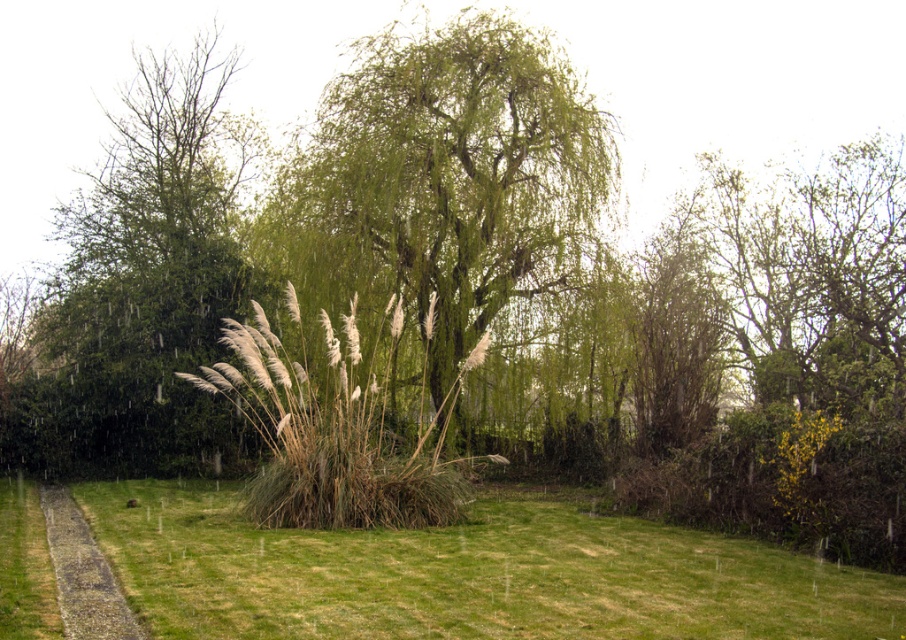
You are standing at the starting point of the pathway in the grassy area. You want to walk directly towards the green leafy willow at center. According to the coordinates provided, in which direction should you head relative to your current position?

The green leafy willow at center is located at coordinates point (442, 188). Since you are at the starting point of the pathway, you should head towards the center of the image where the willow is positioned.

You are a bird flying over the green leafy willow at center and the brown grassy reed at center. Which one is higher from the ground?

The green leafy willow at center is above the brown grassy reed at center, so the green leafy willow at center is higher from the ground.